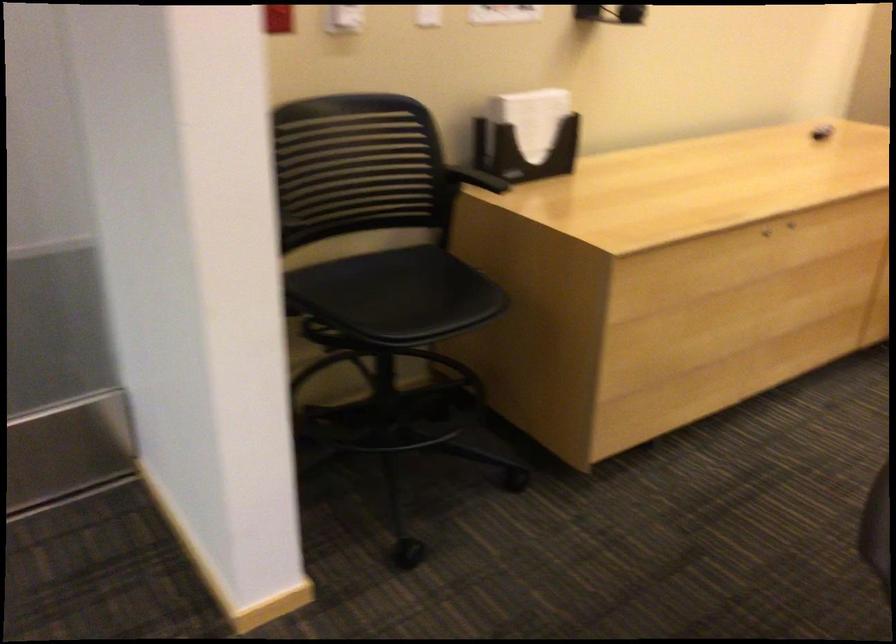
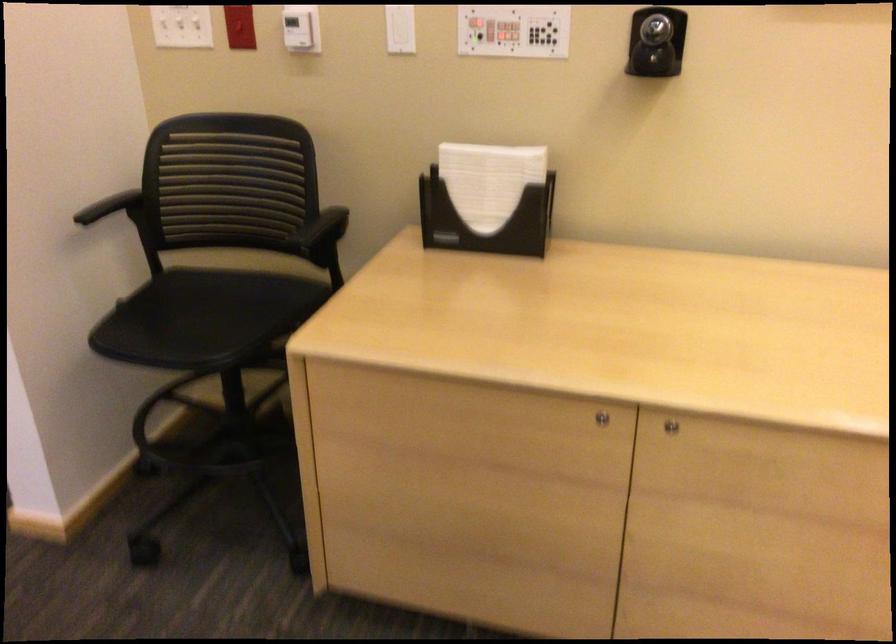
In the second image, find the point that corresponds to point 785,242 in the first image.

(670, 426)